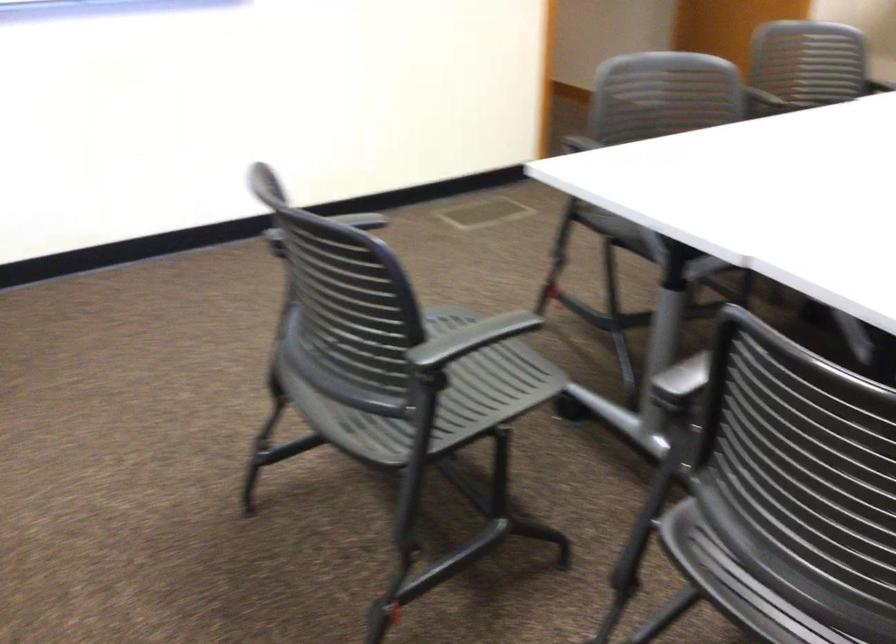
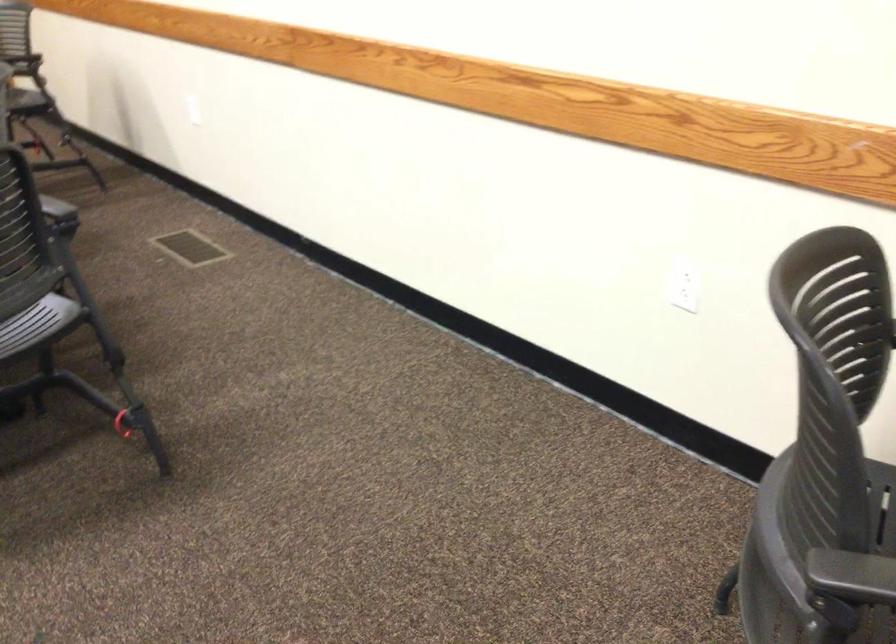
Based on the continuous images, in which direction is the camera rotating?

The rotation direction of the camera is right-down.